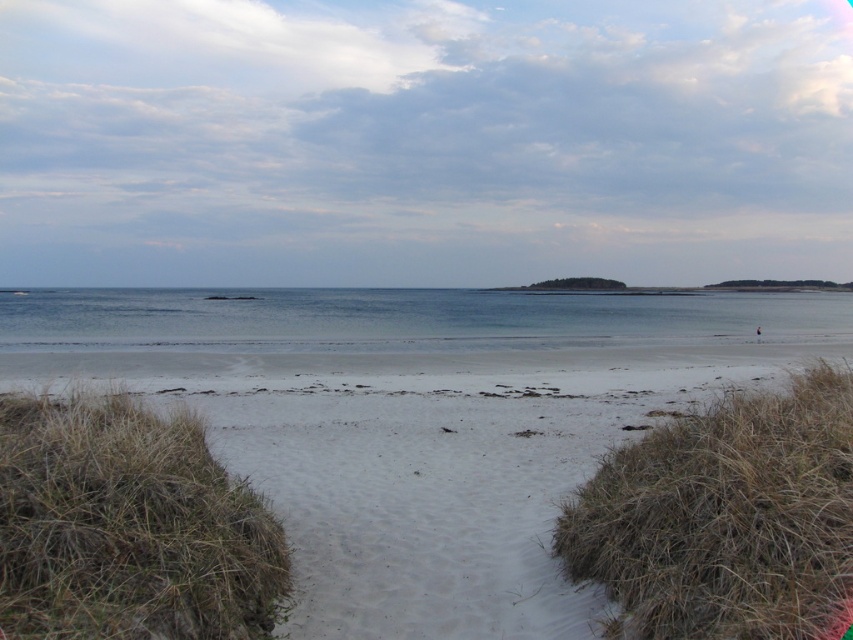
Does white sand at center come behind clear blue water at center?

No, white sand at center is in front of clear blue water at center.

Between white sand at center and clear blue water at center, which one is positioned higher?

clear blue water at center

Between point (288, 465) and point (200, 314), which one is positioned behind?

Point (200, 314)

In order to click on white sand at center in this screenshot , I will do `click(431, 474)`.